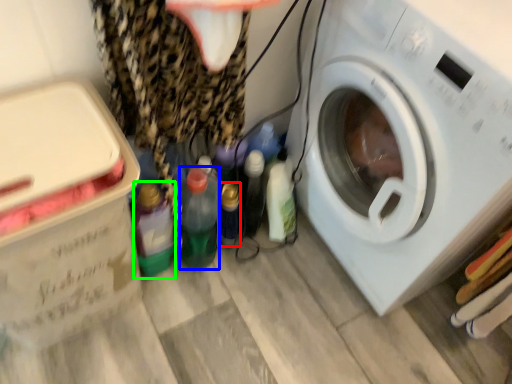
Question: Considering the real-world distances, which object is closest to bottle (highlighted by a red box)? bottle (highlighted by a blue box) or bottle (highlighted by a green box).

Choices:
 (A) bottle
 (B) bottle

Answer: (A)